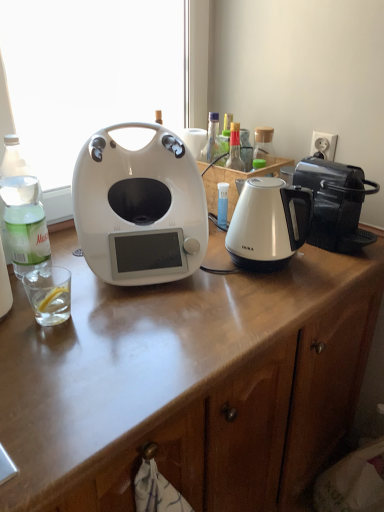
Question: From the image's perspective, would you say clear glass bottle at left is shown under white glossy kettle at center-right?

Choices:
 (A) no
 (B) yes

Answer: (A)

Question: Does clear glass bottle at left turn towards white glossy kettle at center-right?

Choices:
 (A) yes
 (B) no

Answer: (B)

Question: Can you confirm if clear glass bottle at left is bigger than white glossy kettle at center-right?

Choices:
 (A) no
 (B) yes

Answer: (A)

Question: Can you confirm if clear glass bottle at left is smaller than white glossy kettle at center-right?

Choices:
 (A) yes
 (B) no

Answer: (A)

Question: Would you say clear glass bottle at left is a long distance from white glossy kettle at center-right?

Choices:
 (A) no
 (B) yes

Answer: (A)

Question: In terms of width, does clear glass at left look wider or thinner when compared to white glossy window screen at center?

Choices:
 (A) thin
 (B) wide

Answer: (A)

Question: Do you think clear glass at left is within white glossy window screen at center, or outside of it?

Choices:
 (A) outside
 (B) inside

Answer: (A)

Question: Is point (46, 266) closer or farther from the camera than point (82, 113)?

Choices:
 (A) closer
 (B) farther

Answer: (A)

Question: Is clear glass at left to the left or to the right of white glossy window screen at center in the image?

Choices:
 (A) left
 (B) right

Answer: (A)

Question: From a real-world perspective, relative to white glossy window screen at center, is white glossy kettle at center-right vertically above or below?

Choices:
 (A) above
 (B) below

Answer: (B)

Question: In terms of width, does white glossy kettle at center-right look wider or thinner when compared to white glossy window screen at center?

Choices:
 (A) wide
 (B) thin

Answer: (A)

Question: Considering the positions of point pyautogui.click(x=256, y=263) and point pyautogui.click(x=31, y=49), is point pyautogui.click(x=256, y=263) closer or farther from the camera than point pyautogui.click(x=31, y=49)?

Choices:
 (A) closer
 (B) farther

Answer: (A)

Question: From the image's perspective, is white glossy kettle at center-right above or below white glossy window screen at center?

Choices:
 (A) above
 (B) below

Answer: (B)

Question: From their relative heights in the image, would you say white glossy coffee maker at center is taller or shorter than white glossy kettle at center-right?

Choices:
 (A) short
 (B) tall

Answer: (B)

Question: From a real-world perspective, is white glossy coffee maker at center positioned above or below white glossy kettle at center-right?

Choices:
 (A) above
 (B) below

Answer: (A)